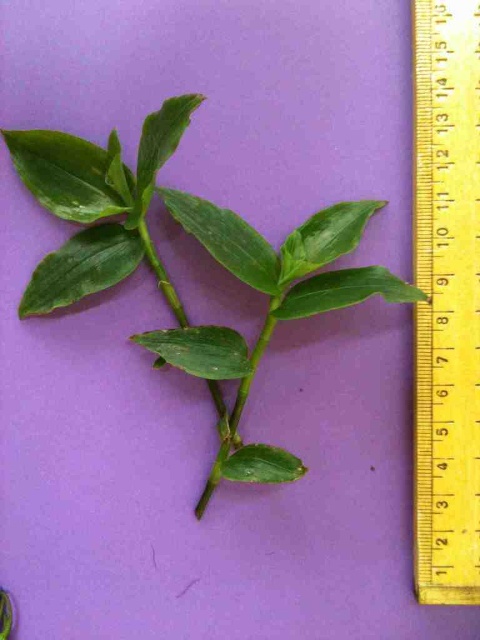
Question: Which of the following is the farthest from the observer?

Choices:
 (A) (205, 237)
 (B) (471, 406)

Answer: (A)

Question: Can you confirm if green matte leafy branch at center is positioned to the left of yellow plastic ruler at right?

Choices:
 (A) no
 (B) yes

Answer: (B)

Question: Which of the following is the farthest from the observer?

Choices:
 (A) (415, 84)
 (B) (222, 248)

Answer: (B)

Question: Is green matte leafy branch at center thinner than yellow plastic ruler at right?

Choices:
 (A) yes
 (B) no

Answer: (B)

Question: Is green matte leafy branch at center closer to camera compared to yellow plastic ruler at right?

Choices:
 (A) yes
 (B) no

Answer: (B)

Question: Which of the following is the closest to the observer?

Choices:
 (A) green matte leafy branch at center
 (B) yellow plastic ruler at right

Answer: (B)